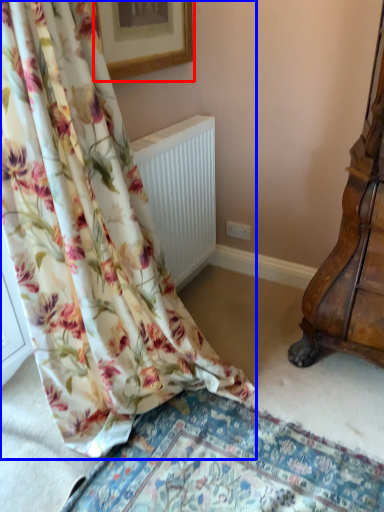
Question: Which of the following is the farthest to the observer, picture frame (highlighted by a red box) or curtain (highlighted by a blue box)?

Choices:
 (A) picture frame
 (B) curtain

Answer: (A)